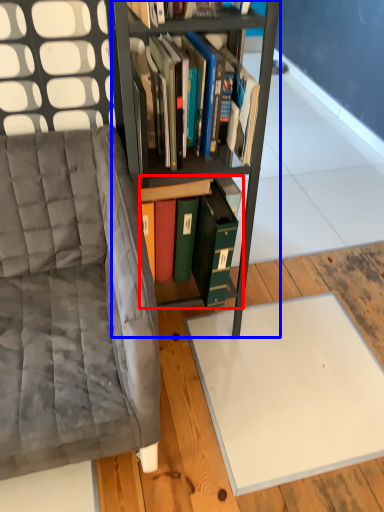
Question: Which of the following is the farthest to the observer, book (highlighted by a red box) or bookcase (highlighted by a blue box)?

Choices:
 (A) book
 (B) bookcase

Answer: (A)